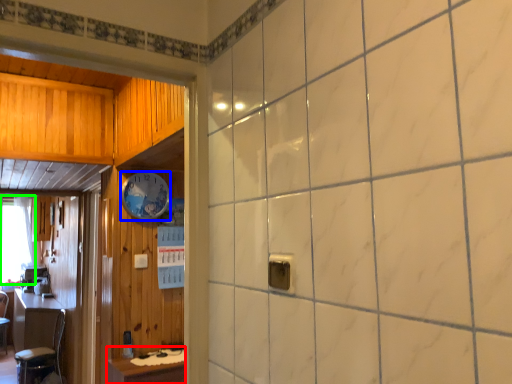
Question: Which object is the closest to the table (highlighted by a red box)? Choose among these: clock (highlighted by a blue box) or window (highlighted by a green box).

Choices:
 (A) clock
 (B) window

Answer: (A)